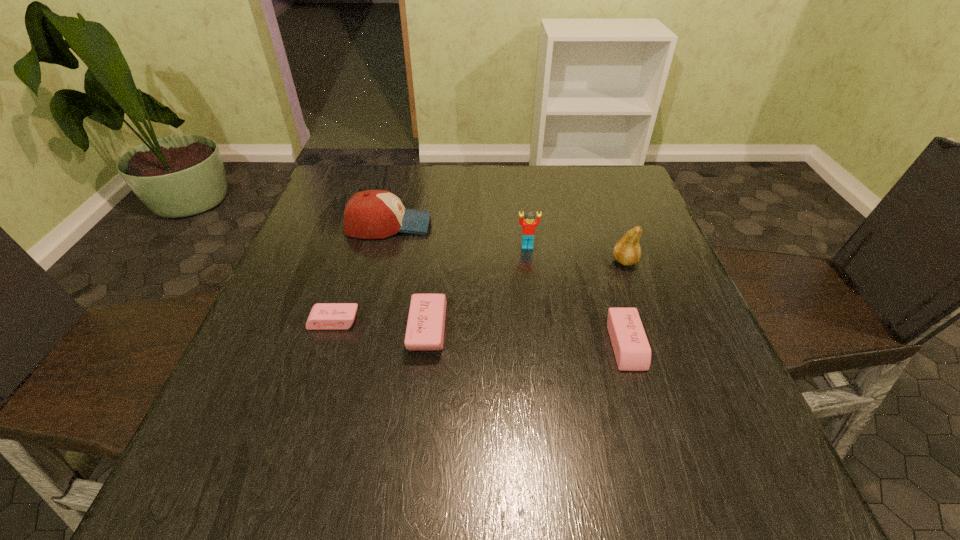
Identify the location of free spot between the pear and the second tallest eraser. (625, 303).

Image resolution: width=960 pixels, height=540 pixels. In order to click on vacant area that lies between the third farthest object and the second farthest object in this screenshot , I will do `click(576, 254)`.

At what (x,y) coordinates should I click in order to perform the action: click on free space between the baseball cap and the shortest object. Please return your answer as a coordinate pair (x, y). Looking at the image, I should click on click(361, 273).

Identify the location of vacant space that is in between the fourth tallest object and the baseball cap. This screenshot has height=540, width=960. pyautogui.click(x=408, y=277).

What are the coordinates of `free space that is in between the leftmost eraser and the farthest object` in the screenshot? It's located at (361, 273).

Where is `free space between the farthest object and the third object from right to left`? The image size is (960, 540). free space between the farthest object and the third object from right to left is located at coordinates (458, 235).

Identify the location of free area in between the pear and the tallest eraser. This screenshot has height=540, width=960. (526, 295).

At what (x,y) coordinates should I click in order to perform the action: click on free space between the tallest eraser and the pear. Please return your answer as a coordinate pair (x, y). The height and width of the screenshot is (540, 960). Looking at the image, I should click on (526, 295).

This screenshot has width=960, height=540. I want to click on the third closest object relative to the second tallest eraser, so click(x=425, y=328).

Identify which object is located as the third nearest to the tallest eraser. Please provide its 2D coordinates. Your answer should be formatted as a tuple, i.e. [(x, y)], where the tuple contains the x and y coordinates of a point satisfying the conditions above.

[(529, 223)]